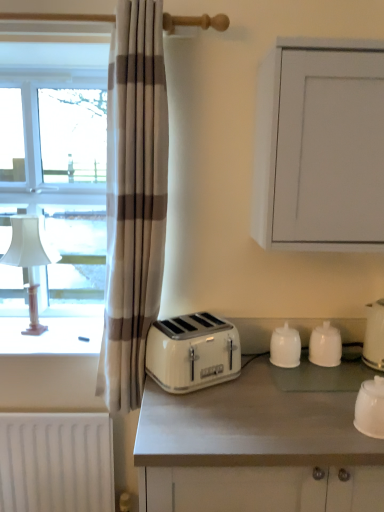
Question: Considering the relative sizes of beige striped curtain at left and white matte countertop at center in the image provided, is beige striped curtain at left taller than white matte countertop at center?

Choices:
 (A) no
 (B) yes

Answer: (B)

Question: Considering the relative sizes of beige striped curtain at left and white matte countertop at center in the image provided, is beige striped curtain at left shorter than white matte countertop at center?

Choices:
 (A) no
 (B) yes

Answer: (A)

Question: From a real-world perspective, is beige striped curtain at left positioned under white matte countertop at center based on gravity?

Choices:
 (A) no
 (B) yes

Answer: (A)

Question: Is beige striped curtain at left positioned beyond the bounds of white matte countertop at center?

Choices:
 (A) yes
 (B) no

Answer: (A)

Question: Is the position of beige striped curtain at left more distant than that of white matte countertop at center?

Choices:
 (A) yes
 (B) no

Answer: (A)

Question: Looking at their shapes, would you say white glossy cup at lower right, which ranks as the 2th kitchen appliance in right-to-left order, is wider or thinner than white glossy salt shaker at center, which is the second kitchen appliance in back-to-front order?

Choices:
 (A) wide
 (B) thin

Answer: (A)

Question: Is point (374, 389) closer or farther from the camera than point (284, 364)?

Choices:
 (A) closer
 (B) farther

Answer: (A)

Question: Considering the positions of white glossy cup at lower right, which is the 1th kitchen appliance from front to back, and white glossy salt shaker at center, which is the second kitchen appliance in back-to-front order, in the image, is white glossy cup at lower right, which is the 1th kitchen appliance from front to back, taller or shorter than white glossy salt shaker at center, which is the second kitchen appliance in back-to-front order,?

Choices:
 (A) tall
 (B) short

Answer: (A)

Question: Is white glossy cup at lower right, which appears as the third kitchen appliance when viewed from the left, inside the boundaries of white glossy salt shaker at center, which is the second kitchen appliance in back-to-front order, or outside?

Choices:
 (A) outside
 (B) inside

Answer: (A)

Question: In terms of width, does white plastic toaster at center look wider or thinner when compared to white matte cabinet at upper right?

Choices:
 (A) wide
 (B) thin

Answer: (B)

Question: From a real-world perspective, is white plastic toaster at center physically located above or below white matte cabinet at upper right?

Choices:
 (A) below
 (B) above

Answer: (A)

Question: Choose the correct answer: Is white plastic toaster at center inside white matte cabinet at upper right or outside it?

Choices:
 (A) inside
 (B) outside

Answer: (B)

Question: From the image's perspective, is white plastic toaster at center positioned above or below white matte cabinet at upper right?

Choices:
 (A) below
 (B) above

Answer: (A)

Question: From the image's perspective, is white glossy cups at center, which is the 1th kitchen appliance from back to front, located above or below white glossy kettle at right, the 4th kitchen appliance in the left-to-right sequence?

Choices:
 (A) above
 (B) below

Answer: (B)

Question: Relative to white glossy kettle at right, the 2th kitchen appliance in the front-to-back sequence, is white glossy cups at center, which appears as the 4th kitchen appliance when viewed from the front, in front or behind?

Choices:
 (A) behind
 (B) front

Answer: (A)